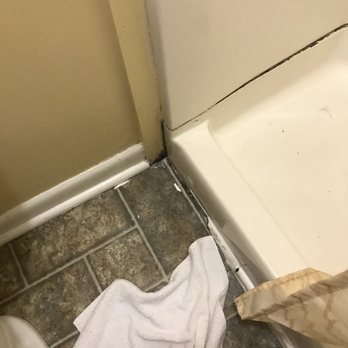
Locate an element on the screen. The height and width of the screenshot is (348, 348). white cloth towel is located at coordinates (164, 305).